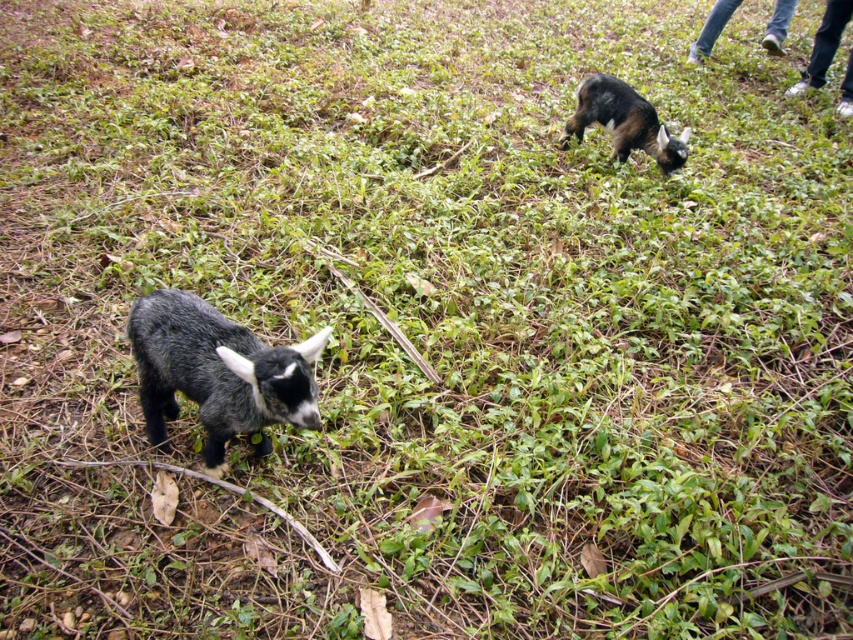
You are standing in the scene and see the white fabric pants at upper right and the blue jeans at upper right. Which one is positioned lower?

The white fabric pants at upper right is below blue jeans at upper right, so the white fabric pants at upper right is positioned lower.

You are standing in a field with two goats. You notice a specific point marked at coordinates point (257, 365). Given that you are 5 feet tall, can you determine if this point is within your line of sight?

The point (257, 365) is 6.17 feet away from the camera, so yes, it is within your line of sight since it is within a typical viewing distance for someone 5 feet tall.